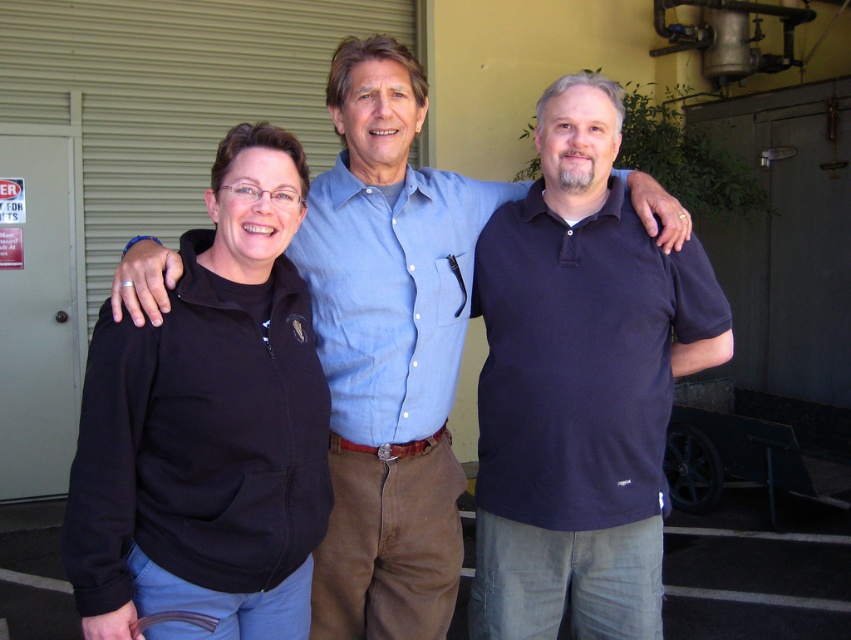
Question: Considering the relative positions of blue cotton shirt at center and white metal door at left in the image provided, where is blue cotton shirt at center located with respect to white metal door at left?

Choices:
 (A) left
 (B) right

Answer: (B)

Question: Which point is closer to the camera?

Choices:
 (A) black fleece jacket at left
 (B) white metal door at left

Answer: (A)

Question: Does dark blue polo shirt at center appear on the left side of blue cotton shirt at center?

Choices:
 (A) yes
 (B) no

Answer: (B)

Question: Estimate the real-world distances between objects in this image. Which object is farther from the white metal door at left?

Choices:
 (A) dark blue polo shirt at center
 (B) blue cotton shirt at center

Answer: (A)

Question: Which point is farther from the camera taking this photo?

Choices:
 (A) (153, 435)
 (B) (432, 493)
 (C) (50, 454)
 (D) (478, 410)

Answer: (C)

Question: Does dark blue polo shirt at center have a larger size compared to black fleece jacket at left?

Choices:
 (A) no
 (B) yes

Answer: (B)